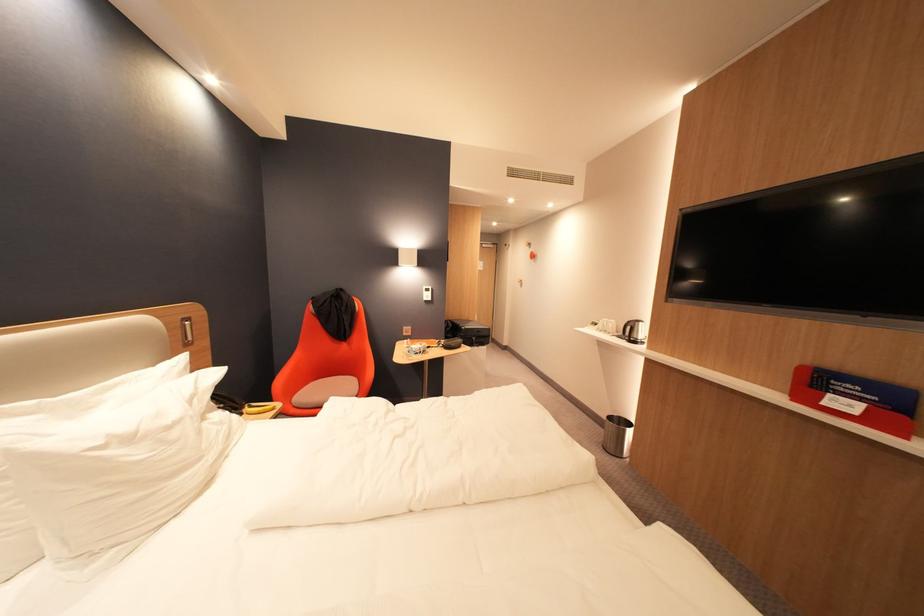
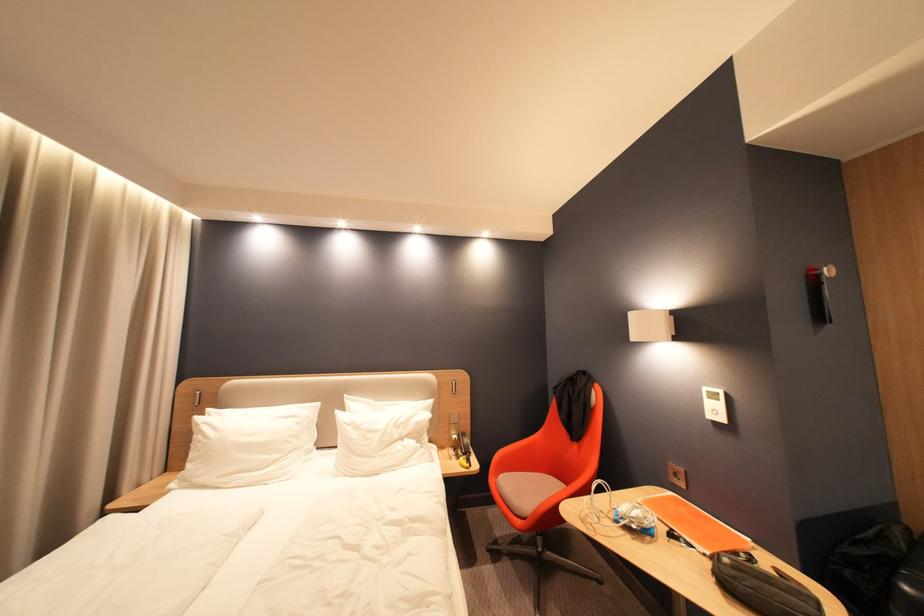
The point at (436, 297) is marked in the first image. Where is the corresponding point in the second image?

(724, 413)